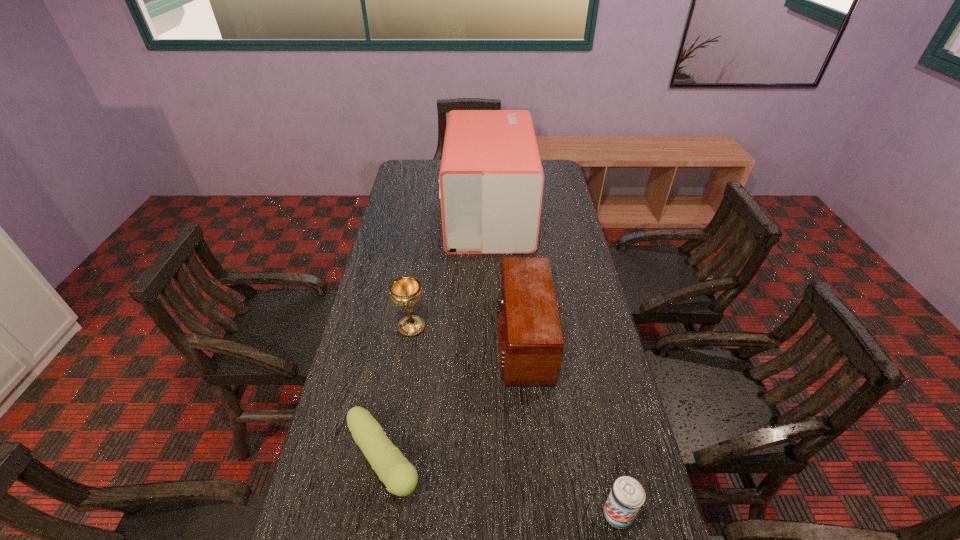
The width and height of the screenshot is (960, 540). What are the coordinates of `vacant space at the left edge of the desktop` in the screenshot? It's located at (408, 208).

Find the location of a particular element. This screenshot has height=540, width=960. vacant space at the right edge is located at coordinates (574, 274).

The height and width of the screenshot is (540, 960). I want to click on free space between the cucumber and the beer can, so click(501, 488).

The image size is (960, 540). Find the location of `free space between the rightmost object and the chalice`. free space between the rightmost object and the chalice is located at coordinates (515, 421).

You are a GUI agent. You are given a task and a screenshot of the screen. Output one action in this format:
    pyautogui.click(x=<x>, y=<y>)
    Task: Click on the vacant region between the rightmost object and the chalice
    The width and height of the screenshot is (960, 540).
    Given the screenshot: What is the action you would take?
    pyautogui.click(x=515, y=421)

Locate an element on the screen. This screenshot has width=960, height=540. vacant space that's between the chalice and the beer can is located at coordinates (515, 421).

Where is `free space that is in between the chalice and the radio receiver`? free space that is in between the chalice and the radio receiver is located at coordinates (468, 333).

This screenshot has height=540, width=960. What are the coordinates of `unoccupied area between the cucumber and the radio receiver` in the screenshot? It's located at (453, 400).

Image resolution: width=960 pixels, height=540 pixels. Find the location of `free space between the chalice and the beer can`. free space between the chalice and the beer can is located at coordinates (515, 421).

This screenshot has width=960, height=540. I want to click on free area in between the shortest object and the chalice, so click(397, 394).